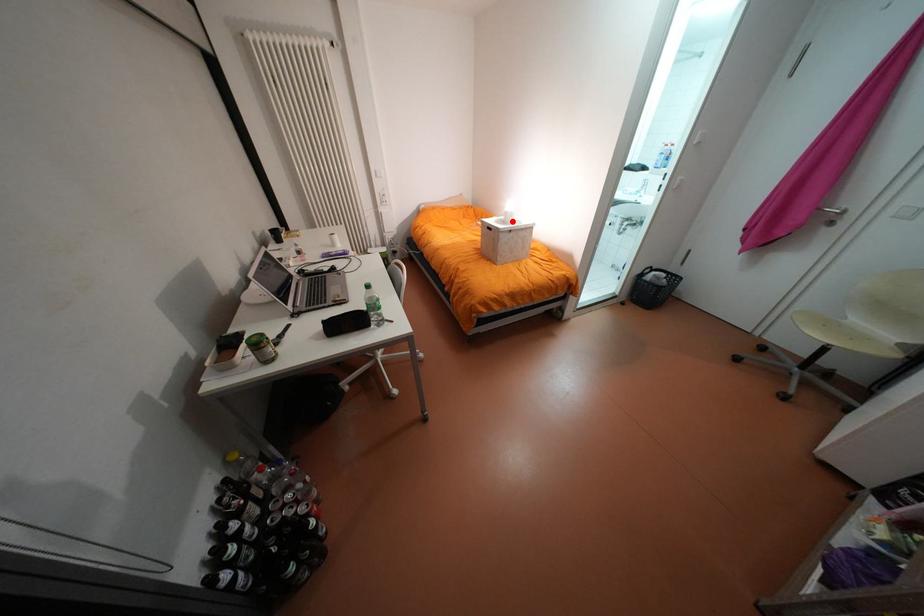
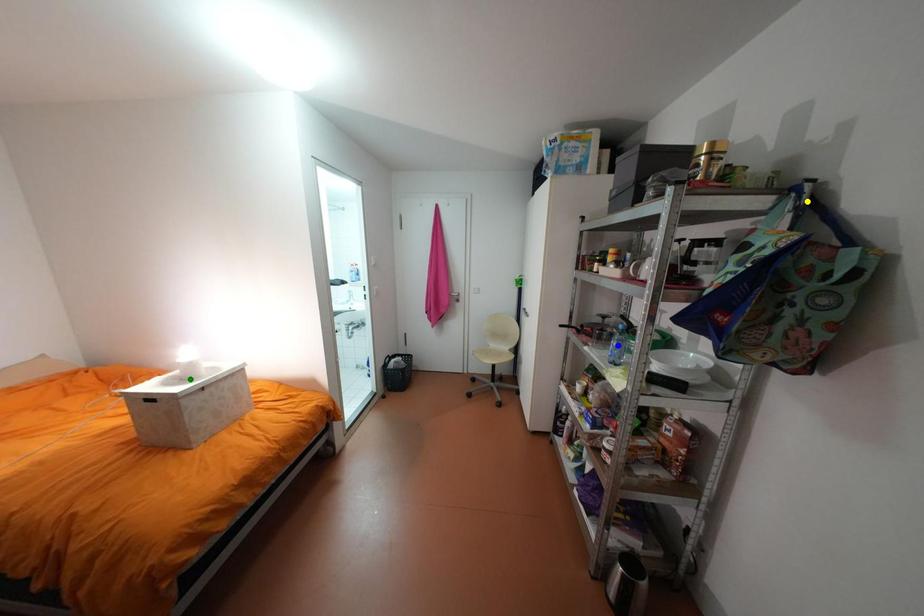
Question: I am providing you with two images of the same scene from different viewpoints. A red point is marked on the first image. You are given multiple points on the second image. Which mark in image 2 goes with the point in image 1?

Choices:
 (A) yellow point
 (B) blue point
 (C) green point

Answer: (C)